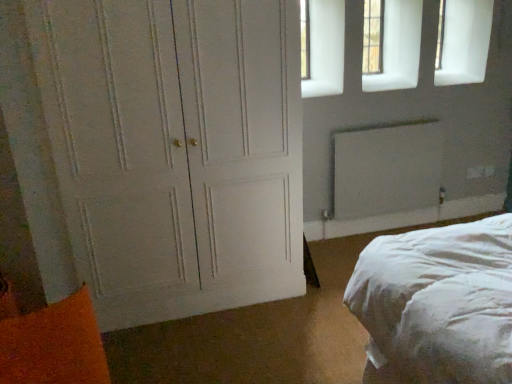
Question: Visually, is white matte radiator at upper right positioned to the left or to the right of orange fuzzy pillow at lower left?

Choices:
 (A) left
 (B) right

Answer: (B)

Question: Based on their sizes in the image, would you say white matte radiator at upper right is bigger or smaller than orange fuzzy pillow at lower left?

Choices:
 (A) small
 (B) big

Answer: (A)

Question: Which object is the farthest from the clear glass window at upper right?

Choices:
 (A) orange fuzzy pillow at lower left
 (B) white painted wood door at left
 (C) white matte radiator at upper right

Answer: (A)

Question: Estimate the real-world distances between objects in this image. Which object is closer to the clear glass window at upper right?

Choices:
 (A) white matte radiator at upper right
 (B) orange fuzzy pillow at lower left
 (C) white painted wood door at left

Answer: (A)